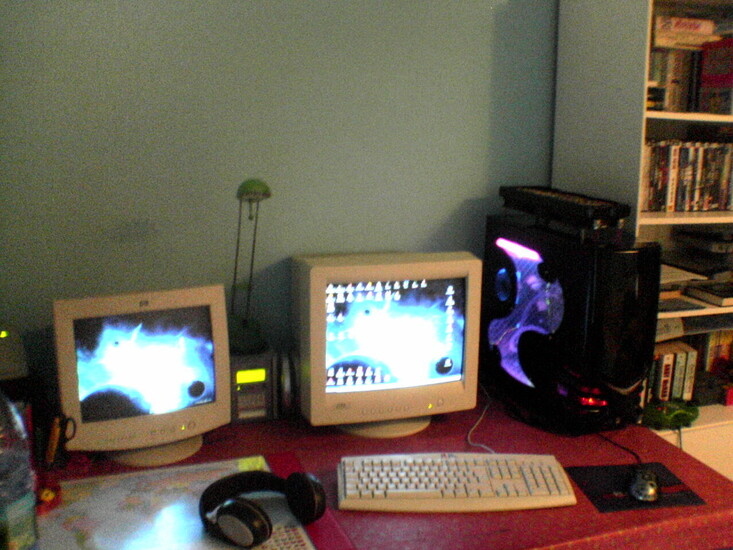
Locate an element on the screen. computer mousepad is located at coordinates (597, 482), (611, 497), (674, 490).